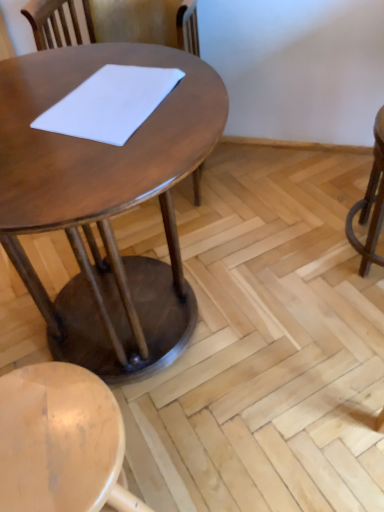
Question: Can you confirm if white matte notepad at center is shorter than shiny brown table at center?

Choices:
 (A) yes
 (B) no

Answer: (A)

Question: From a real-world perspective, is white matte notepad at center on top of shiny brown table at center?

Choices:
 (A) yes
 (B) no

Answer: (A)

Question: From the image's perspective, does white matte notepad at center appear higher than shiny brown table at center?

Choices:
 (A) yes
 (B) no

Answer: (A)

Question: Is white matte notepad at center at the right side of shiny brown table at center?

Choices:
 (A) yes
 (B) no

Answer: (A)

Question: Are white matte notepad at center and shiny brown table at center making contact?

Choices:
 (A) no
 (B) yes

Answer: (A)

Question: Is white matte notepad at center further to camera compared to shiny brown table at center?

Choices:
 (A) no
 (B) yes

Answer: (B)

Question: Is there a large distance between shiny brown table at center and white matte notepad at center?

Choices:
 (A) yes
 (B) no

Answer: (B)

Question: Is shiny brown table at center positioned with its back to white matte notepad at center?

Choices:
 (A) no
 (B) yes

Answer: (A)

Question: Considering the relative sizes of shiny brown table at center and white matte notepad at center in the image provided, is shiny brown table at center smaller than white matte notepad at center?

Choices:
 (A) no
 (B) yes

Answer: (A)

Question: Does shiny brown table at center have a greater width compared to white matte notepad at center?

Choices:
 (A) yes
 (B) no

Answer: (A)

Question: Is shiny brown table at center beside white matte notepad at center?

Choices:
 (A) no
 (B) yes

Answer: (A)

Question: Is shiny brown table at center positioned behind white matte notepad at center?

Choices:
 (A) no
 (B) yes

Answer: (A)

Question: Are shiny brown table at center and light wood stool at lower left located far from each other?

Choices:
 (A) no
 (B) yes

Answer: (A)